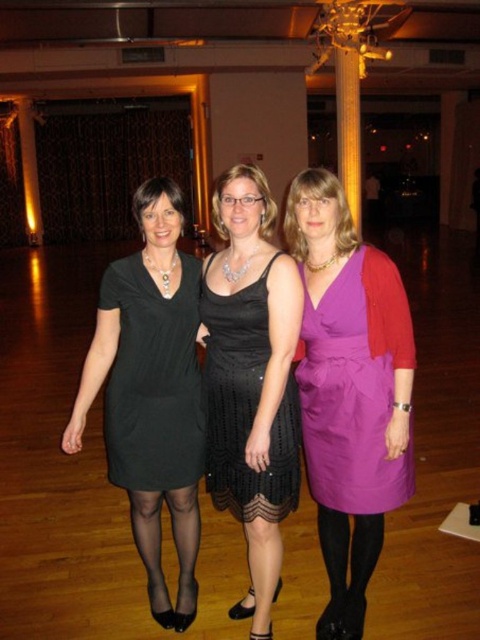
Question: Does purple satin dress at center appear on the left side of black sequined dress at center?

Choices:
 (A) yes
 (B) no

Answer: (B)

Question: Does black sequined dress at center come in front of gold polished column at center?

Choices:
 (A) no
 (B) yes

Answer: (B)

Question: Which of the following is the closest to the observer?

Choices:
 (A) (359, 200)
 (B) (182, 392)
 (C) (166, 358)
 (D) (330, 326)

Answer: (D)

Question: Does purple satin dress at center have a larger size compared to gold polished column at center?

Choices:
 (A) no
 (B) yes

Answer: (B)

Question: Which object is positioned farthest from the purple satin dress at center?

Choices:
 (A) matte black dress at center
 (B) black sequined dress at center
 (C) gold polished column at center
 (D) black matte dress at left

Answer: (C)

Question: Which of the following is the farthest from the observer?

Choices:
 (A) click(337, 52)
 (B) click(168, 392)
 (C) click(351, 406)

Answer: (A)